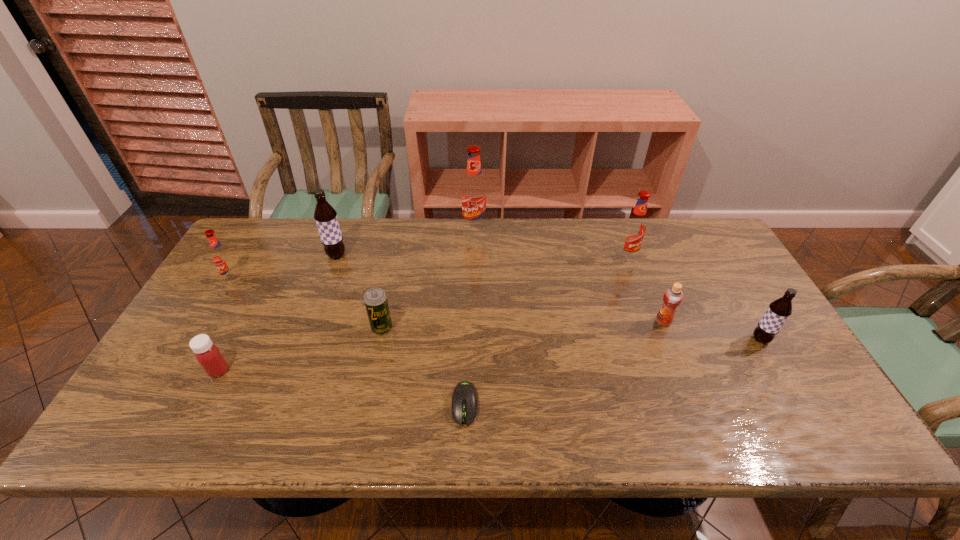
The image size is (960, 540). Identify the location of orange juice. (673, 296).

Locate an element on the screen. The height and width of the screenshot is (540, 960). beer can is located at coordinates (375, 299).

The image size is (960, 540). I want to click on medicine, so [207, 354].

Find the location of a particular element. This screenshot has height=540, width=960. the second object from left to right is located at coordinates (207, 354).

Find the location of `the nearest object`. the nearest object is located at coordinates (464, 398).

You are a GUI agent. You are given a task and a screenshot of the screen. Output one action in this format:
    pyautogui.click(x=<x>, y=<y>)
    Task: Click on the gray computer mouse
    
    Given the screenshot: What is the action you would take?
    pyautogui.click(x=464, y=398)

At what (x,y) coordinates should I click in order to perform the action: click on vacant space located on the front of the tallest object. Please return your answer as a coordinate pair (x, y). The width and height of the screenshot is (960, 540). Looking at the image, I should click on (474, 252).

Find the location of a particular element. vacant space situated on the back of the third object from left to right is located at coordinates (346, 231).

Find the location of `free location located on the front of the second smallest red root beer`. free location located on the front of the second smallest red root beer is located at coordinates (652, 325).

The image size is (960, 540). What are the coordinates of `free space located on the back of the sixth nearest object` in the screenshot? It's located at (257, 238).